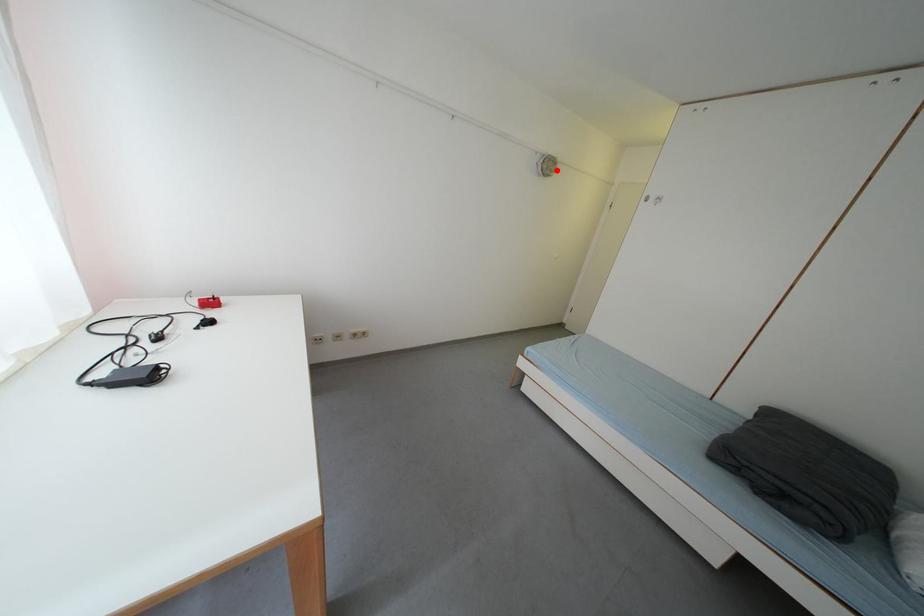
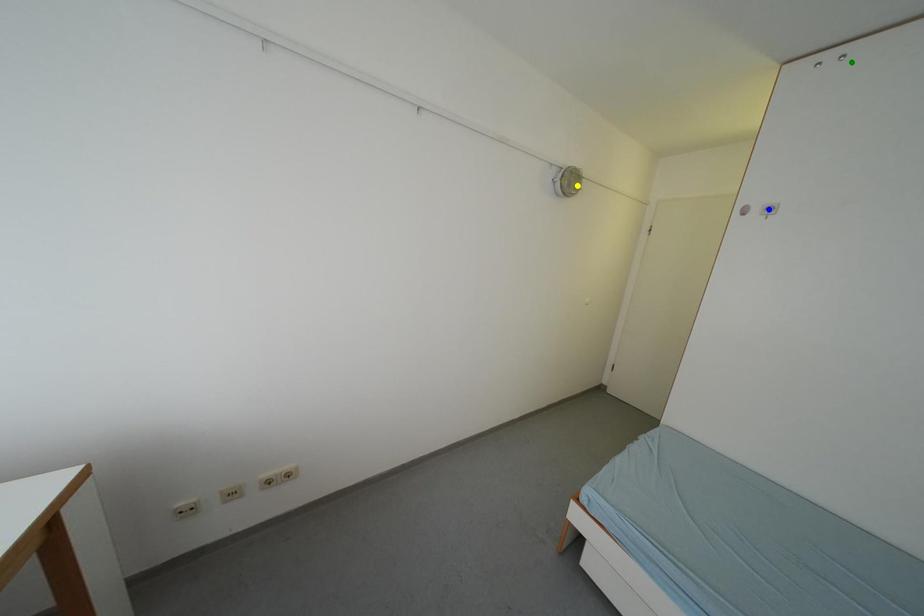
Question: I am providing you with two images of the same scene from different viewpoints. A red point is marked on the first image. You are given multiple points on the second image. Which point in image 2 represents the same 3d spot as the red point in image 1?

Choices:
 (A) yellow point
 (B) green point
 (C) blue point

Answer: (A)